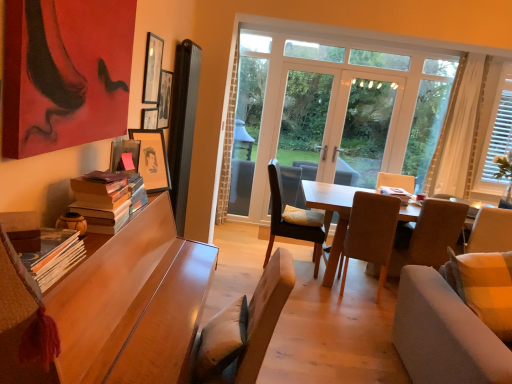
Question: In which direction should I rotate to look at brown fabric chair at center, which is the third chair from left to right?

Choices:
 (A) left
 (B) right

Answer: (B)

Question: From the image's perspective, is brown fabric chair at center, the second chair when ordered from front to back, over transparent glass window at center, which appears as the first window when viewed from the left?

Choices:
 (A) yes
 (B) no

Answer: (B)

Question: Is brown fabric chair at center, which ranks as the 3th chair in back-to-front order, thinner than transparent glass window at center, the second window positioned from the right?

Choices:
 (A) yes
 (B) no

Answer: (B)

Question: Can you confirm if brown fabric chair at center, which ranks as the 3th chair in back-to-front order, is wider than transparent glass window at center, which appears as the first window when viewed from the left?

Choices:
 (A) no
 (B) yes

Answer: (B)

Question: Does brown fabric chair at center, which is the third chair from left to right, appear on the right side of transparent glass window at center, the second window positioned from the right?

Choices:
 (A) yes
 (B) no

Answer: (B)

Question: Considering the relative positions of brown fabric chair at center, the second chair when ordered from front to back, and transparent glass window at center, the second window positioned from the right, in the image provided, is brown fabric chair at center, the second chair when ordered from front to back, to the left of transparent glass window at center, the second window positioned from the right, from the viewer's perspective?

Choices:
 (A) no
 (B) yes

Answer: (B)

Question: From the image's perspective, is brown fabric chair at center, the second chair when ordered from front to back, located beneath transparent glass window at center, the second window positioned from the right?

Choices:
 (A) yes
 (B) no

Answer: (A)

Question: Can you confirm if hardcover books at left, positioned as the 2th book in right-to-left order, is smaller than white wooden blinds at right, positioned as the first window in right-to-left order?

Choices:
 (A) yes
 (B) no

Answer: (A)

Question: Considering the relative positions of hardcover books at left, positioned as the 2th book in right-to-left order, and white wooden blinds at right, positioned as the first window in right-to-left order, in the image provided, is hardcover books at left, positioned as the 2th book in right-to-left order, in front of white wooden blinds at right, positioned as the first window in right-to-left order,?

Choices:
 (A) yes
 (B) no

Answer: (A)

Question: Considering the relative sizes of hardcover books at left, the second book when ordered from left to right, and white wooden blinds at right, positioned as the first window in right-to-left order, in the image provided, is hardcover books at left, the second book when ordered from left to right, wider than white wooden blinds at right, positioned as the first window in right-to-left order,?

Choices:
 (A) yes
 (B) no

Answer: (B)

Question: From the image's perspective, is hardcover books at left, the 2th book viewed from the front, under white wooden blinds at right, positioned as the first window in right-to-left order?

Choices:
 (A) yes
 (B) no

Answer: (A)

Question: Considering the relative sizes of hardcover books at left, positioned as the 2th book in right-to-left order, and white wooden blinds at right, which is the 2th window from left to right, in the image provided, is hardcover books at left, positioned as the 2th book in right-to-left order, taller than white wooden blinds at right, which is the 2th window from left to right,?

Choices:
 (A) no
 (B) yes

Answer: (A)

Question: From the image's perspective, does hardcover books at left, the 2th book viewed from the front, appear higher than white wooden blinds at right, which is the 2th window from left to right?

Choices:
 (A) yes
 (B) no

Answer: (B)

Question: Is hardcover books at left, the first book positioned from the front, thinner than transparent glass door at center?

Choices:
 (A) yes
 (B) no

Answer: (B)